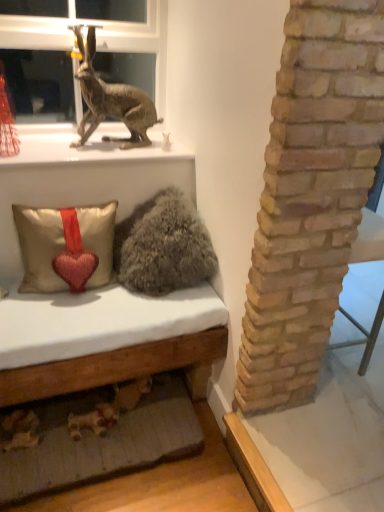
Question: Based on their positions, is metallic rabbit at upper left located to the left or right of fuzzy gray pillow at center?

Choices:
 (A) left
 (B) right

Answer: (A)

Question: Considering the positions of metallic rabbit at upper left and fuzzy gray pillow at center in the image, is metallic rabbit at upper left taller or shorter than fuzzy gray pillow at center?

Choices:
 (A) tall
 (B) short

Answer: (A)

Question: Based on their relative distances, which object is nearer to the metallic rabbit at upper left?

Choices:
 (A) fuzzy gray pillow at center
 (B) satin beige pillow with heart at lower left
 (C) metallic gold statue at upper left
 (D) metallic rabbit at upper left

Answer: (C)

Question: Which object is positioned closest to the metallic gold statue at upper left?

Choices:
 (A) fuzzy gray pillow at center
 (B) satin beige pillow with heart at lower left
 (C) metallic rabbit at upper left
 (D) metallic rabbit at upper left

Answer: (C)